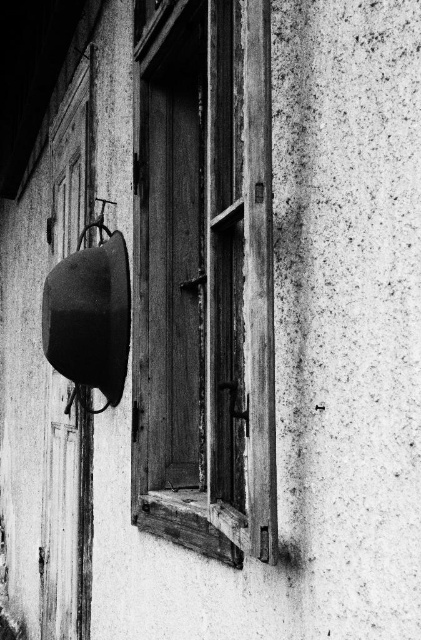
Question: Which object is closer to the camera taking this photo?

Choices:
 (A) metallic smooth pot at left
 (B) wooden at left

Answer: (A)

Question: Which object is farther from the camera taking this photo?

Choices:
 (A) wooden at left
 (B) wooden window at center

Answer: (A)

Question: Is wooden window at center behind metallic smooth pot at left?

Choices:
 (A) no
 (B) yes

Answer: (A)

Question: Is wooden window at center positioned at the back of metallic smooth pot at left?

Choices:
 (A) no
 (B) yes

Answer: (A)

Question: Which point is closer to the camera?

Choices:
 (A) wooden at left
 (B) wooden window at center

Answer: (B)

Question: Is wooden at left to the right of metallic smooth pot at left from the viewer's perspective?

Choices:
 (A) yes
 (B) no

Answer: (B)